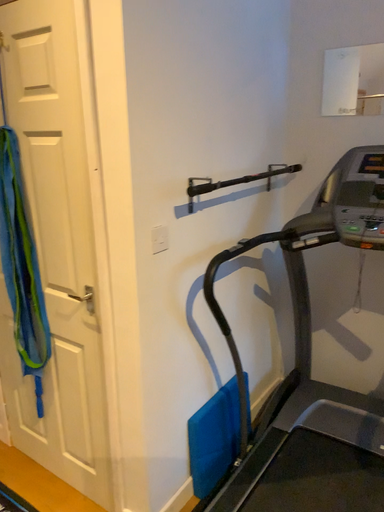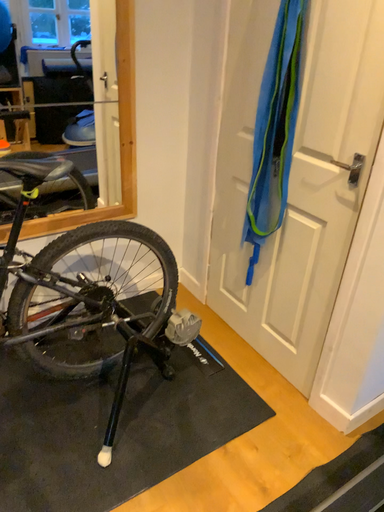
Question: Which way did the camera rotate in the video?

Choices:
 (A) rotated downward
 (B) rotated upward

Answer: (A)